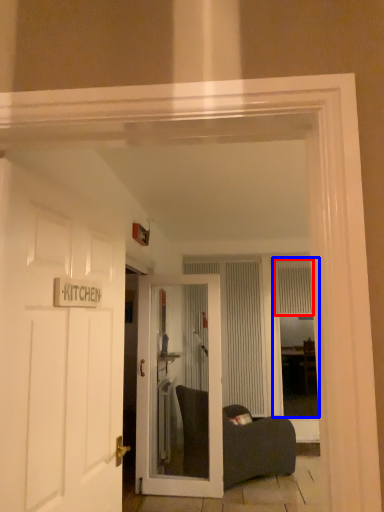
Question: Which object appears closest to the camera in this image, curtain (highlighted by a red box) or window (highlighted by a blue box)?

Choices:
 (A) curtain
 (B) window

Answer: (B)